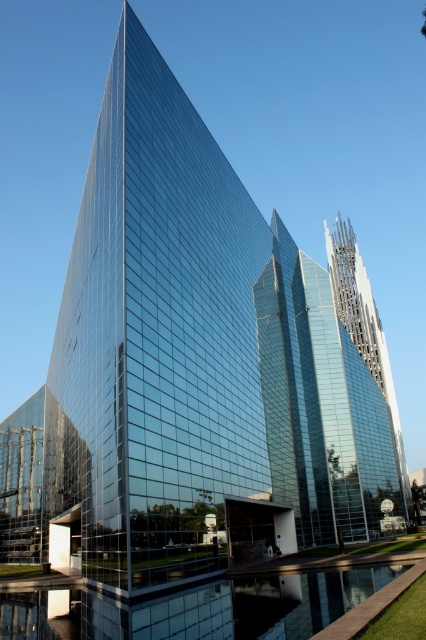
Question: Can you confirm if transparent glass water at lower center is bigger than clear glass tower at center?

Choices:
 (A) no
 (B) yes

Answer: (A)

Question: Among these objects, which one is farthest from the camera?

Choices:
 (A) clear glass tower at center
 (B) transparent glass water at lower center

Answer: (A)

Question: Where is transparent glass water at lower center located in relation to clear glass tower at center in the image?

Choices:
 (A) left
 (B) right

Answer: (A)

Question: Which point is closer to the camera?

Choices:
 (A) (0, 605)
 (B) (345, 241)

Answer: (A)

Question: Does transparent glass water at lower center appear on the left side of clear glass tower at center?

Choices:
 (A) no
 (B) yes

Answer: (B)